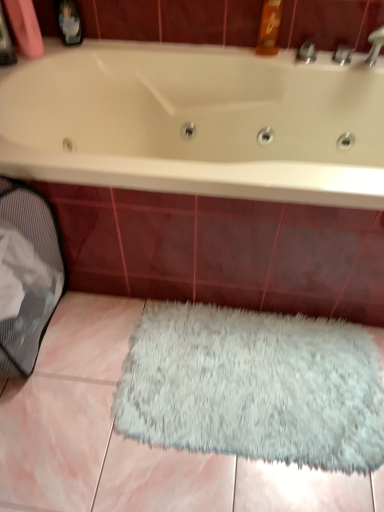
Locate an element on the screen. The height and width of the screenshot is (512, 384). vacant space to the left of white fluffy rug at lower center is located at coordinates (78, 398).